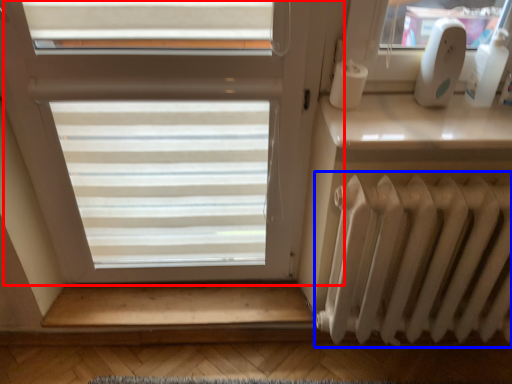
Question: Which object appears closest to the camera in this image, window (highlighted by a red box) or radiator (highlighted by a blue box)?

Choices:
 (A) window
 (B) radiator

Answer: (A)